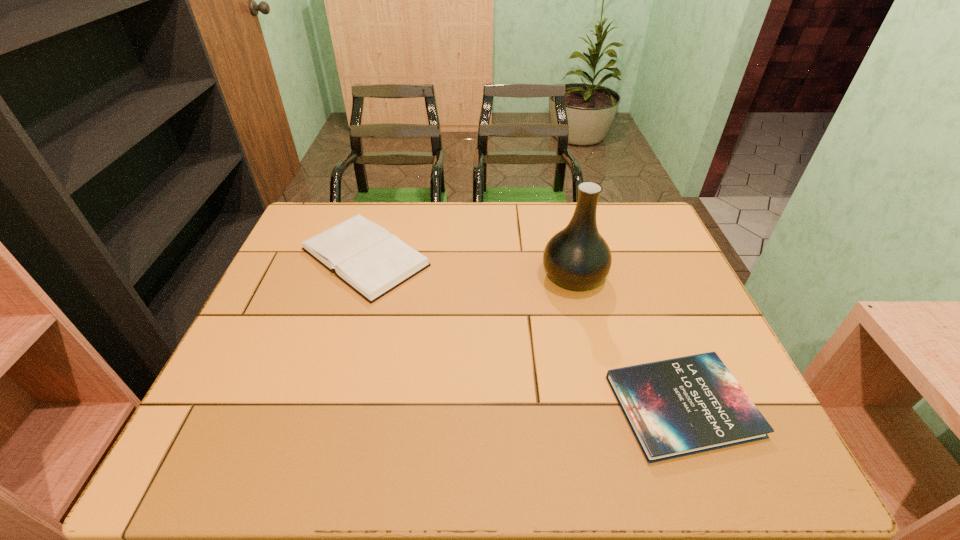
Locate an element on the screen. object that stands as the second closest to the left hardback book is located at coordinates (682, 406).

I want to click on object that is the second nearest to the tallest object, so [x=364, y=255].

This screenshot has width=960, height=540. In order to click on free region that satisfies the following two spatial constraints: 1. on the front side of the farther hardback book; 2. on the left side of the tallest object in this screenshot , I will do `click(359, 276)`.